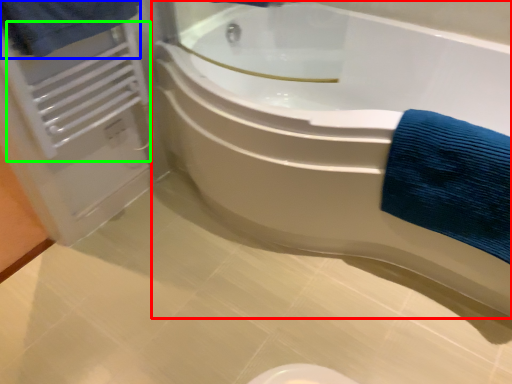
Question: Based on their relative distances, which object is nearer to bathtub (highlighted by a red box)? Choose from bath towel (highlighted by a blue box) and radiator (highlighted by a green box).

Choices:
 (A) bath towel
 (B) radiator

Answer: (B)